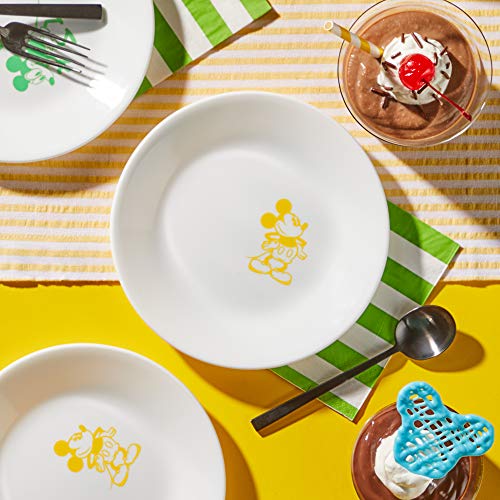
Locate an element on the screen. The width and height of the screenshot is (500, 500). orange and white stripped tablemat is located at coordinates coord(79,228).